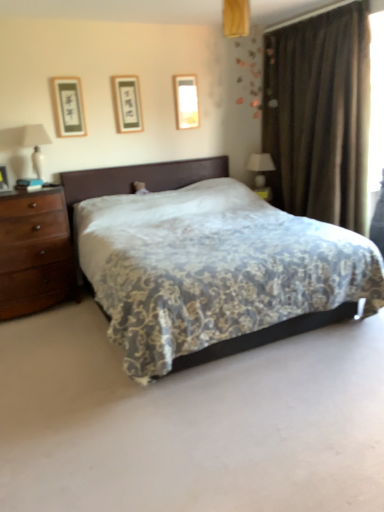
Question: From the image's perspective, is matte black picture frame at upper left, acting as the first picture frame starting from the front, located above matte glass picture frame at upper center, arranged as the 1th picture frame when viewed from the right?

Choices:
 (A) no
 (B) yes

Answer: (A)

Question: Can you confirm if matte black picture frame at upper left, acting as the first picture frame starting from the front, is wider than matte glass picture frame at upper center, placed as the 3th picture frame when sorted from front to back?

Choices:
 (A) no
 (B) yes

Answer: (B)

Question: Is matte black picture frame at upper left, the 3th picture frame when ordered from back to front, facing towards matte glass picture frame at upper center, placed as the 3th picture frame when sorted from front to back?

Choices:
 (A) yes
 (B) no

Answer: (B)

Question: Does matte black picture frame at upper left, marked as the third picture frame in a right-to-left arrangement, appear on the left side of matte glass picture frame at upper center, placed as the 3th picture frame when sorted from front to back?

Choices:
 (A) yes
 (B) no

Answer: (A)

Question: Can you confirm if matte black picture frame at upper left, marked as the third picture frame in a right-to-left arrangement, is bigger than matte glass picture frame at upper center, placed as the 3th picture frame when sorted from front to back?

Choices:
 (A) yes
 (B) no

Answer: (A)

Question: Is matte black picture frame at upper left, placed as the first picture frame when sorted from left to right, turned away from matte glass picture frame at upper center, arranged as the 1th picture frame when viewed from the right?

Choices:
 (A) no
 (B) yes

Answer: (A)

Question: Is white ceramic table lamp at left, which ranks as the first table lamp in front-to-back order, at the right side of white glossy table lamp at upper right, placed as the first table lamp when sorted from back to front?

Choices:
 (A) yes
 (B) no

Answer: (B)

Question: Could you tell me if white ceramic table lamp at left, the 2th table lamp from the back, is facing white glossy table lamp at upper right, placed as the first table lamp when sorted from back to front?

Choices:
 (A) no
 (B) yes

Answer: (A)

Question: Can you confirm if white ceramic table lamp at left, marked as the 2th table lamp in a right-to-left arrangement, is thinner than white glossy table lamp at upper right, which appears as the 2th table lamp when viewed from the front?

Choices:
 (A) no
 (B) yes

Answer: (A)

Question: Is white ceramic table lamp at left, placed as the 1th table lamp when sorted from left to right, positioned in front of white glossy table lamp at upper right, which is counted as the second table lamp, starting from the left?

Choices:
 (A) no
 (B) yes

Answer: (B)

Question: Is white glossy table lamp at upper right, which is the first table lamp in right-to-left order, at the back of white ceramic table lamp at left, placed as the 1th table lamp when sorted from left to right?

Choices:
 (A) yes
 (B) no

Answer: (B)

Question: Is the depth of white ceramic table lamp at left, the 2th table lamp from the back, greater than that of white glossy table lamp at upper right, which is counted as the second table lamp, starting from the left?

Choices:
 (A) no
 (B) yes

Answer: (A)

Question: Is floral-patterned fabric bed at center taller than brown velvet curtain at right?

Choices:
 (A) yes
 (B) no

Answer: (B)